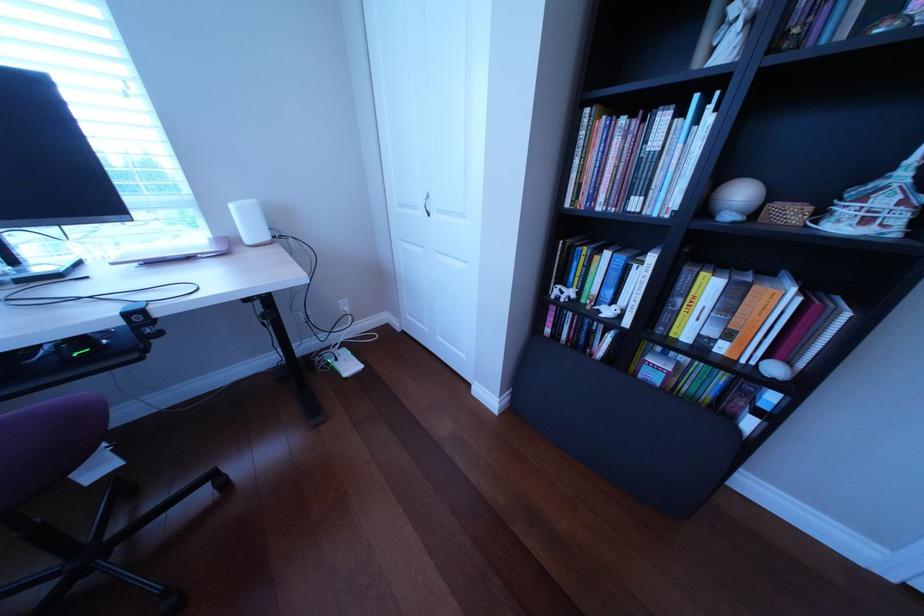
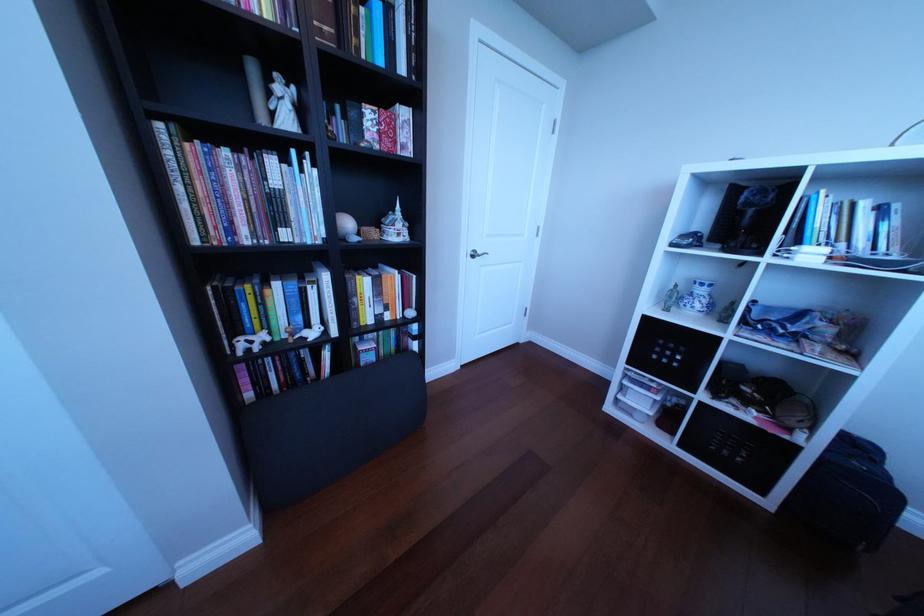
How did the camera likely rotate?

The rotation direction of the camera is right-down.